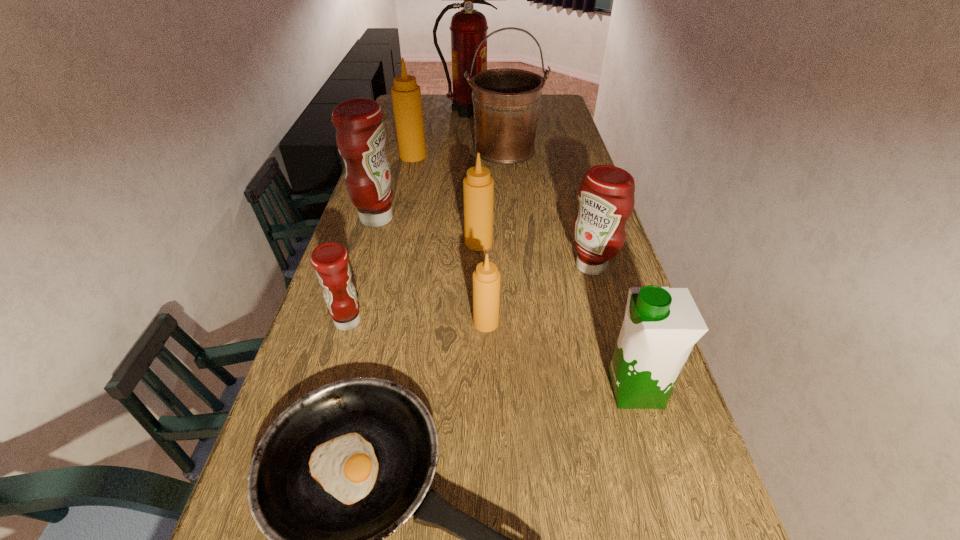
The image size is (960, 540). I want to click on blank area located on the front-facing side of the green soya milk, so click(x=548, y=389).

Find the location of a particular element. Image resolution: width=960 pixels, height=540 pixels. vacant area situated 0.120m on the back of the smallest tan condiment is located at coordinates (486, 282).

You are a GUI agent. You are given a task and a screenshot of the screen. Output one action in this format:
    pyautogui.click(x=<x>, y=<y>)
    Task: Click on the free point located on the front of the smallest red condiment
    The image size is (960, 540).
    Given the screenshot: What is the action you would take?
    pyautogui.click(x=304, y=467)

You are a GUI agent. You are given a task and a screenshot of the screen. Output one action in this format:
    pyautogui.click(x=<x>, y=<y>)
    Task: Click on the object situated at the far edge
    This screenshot has width=960, height=540.
    Given the screenshot: What is the action you would take?
    pyautogui.click(x=468, y=26)

Where is `bucket that is at the right edge`? The image size is (960, 540). bucket that is at the right edge is located at coordinates (506, 101).

The width and height of the screenshot is (960, 540). I want to click on condiment at the right edge, so click(606, 198).

Where is `soya milk at the right edge`? This screenshot has height=540, width=960. soya milk at the right edge is located at coordinates (661, 325).

In the image, there is a desktop. What are the coordinates of `vacant space at the left edge` in the screenshot? It's located at (322, 298).

Identify the location of vacant space at the right edge of the desktop. (602, 296).

Locate an element on the screen. free area in between the fire extinguisher and the farthest condiment is located at coordinates (441, 133).